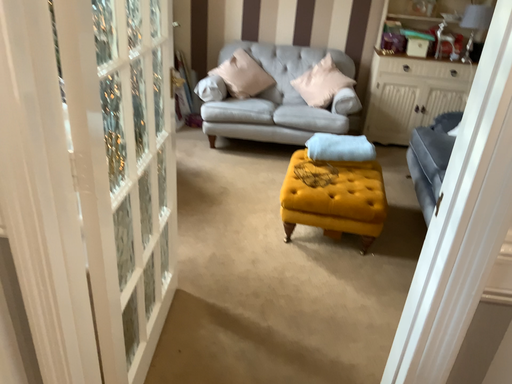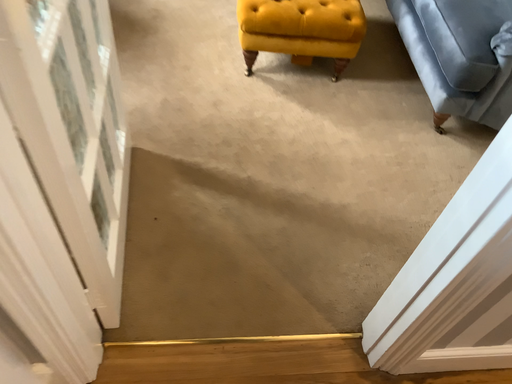
Question: Which way did the camera rotate in the video?

Choices:
 (A) rotated upward
 (B) rotated downward

Answer: (B)